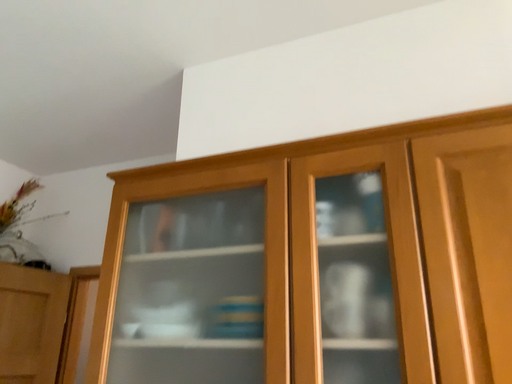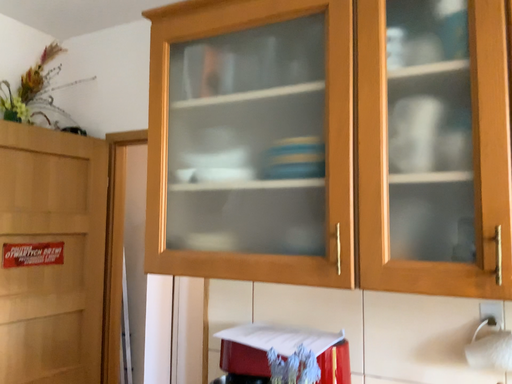
Question: Which way did the camera rotate in the video?

Choices:
 (A) rotated downward
 (B) rotated upward

Answer: (A)